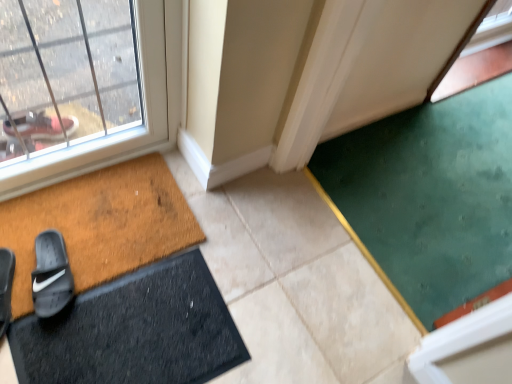
Question: Is brown textured doormat at lower left, which appears as the 1th bath mat when viewed from the top, not within black rubber bath mat at lower left, positioned as the first bath mat in bottom-to-top order?

Choices:
 (A) no
 (B) yes

Answer: (B)

Question: Is brown textured doormat at lower left, which appears as the 1th bath mat when viewed from the top, wider than black rubber bath mat at lower left, positioned as the first bath mat in bottom-to-top order?

Choices:
 (A) yes
 (B) no

Answer: (A)

Question: Could you tell me if brown textured doormat at lower left, which appears as the 1th bath mat when viewed from the top, is turned towards black rubber bath mat at lower left, which is the second bath mat in top-to-bottom order?

Choices:
 (A) no
 (B) yes

Answer: (B)

Question: Is brown textured doormat at lower left, which appears as the 1th bath mat when viewed from the top, thinner than black rubber bath mat at lower left, which is the second bath mat in top-to-bottom order?

Choices:
 (A) yes
 (B) no

Answer: (B)

Question: Does brown textured doormat at lower left, which appears as the 1th bath mat when viewed from the top, lie in front of black rubber bath mat at lower left, positioned as the first bath mat in bottom-to-top order?

Choices:
 (A) yes
 (B) no

Answer: (B)

Question: Is brown textured doormat at lower left, which appears as the 1th bath mat when viewed from the top, in contact with black rubber bath mat at lower left, positioned as the first bath mat in bottom-to-top order?

Choices:
 (A) yes
 (B) no

Answer: (B)

Question: Does black rubber bath mat at lower left, positioned as the first bath mat in bottom-to-top order, have a lesser height compared to black suede slide at lower left, the 1th footwear viewed from the left?

Choices:
 (A) no
 (B) yes

Answer: (B)

Question: Does black rubber bath mat at lower left, which is the second bath mat in top-to-bottom order, have a greater height compared to black suede slide at lower left, the 1th footwear viewed from the left?

Choices:
 (A) no
 (B) yes

Answer: (A)

Question: Is black rubber bath mat at lower left, positioned as the first bath mat in bottom-to-top order, positioned behind black suede slide at lower left, the 1th footwear viewed from the left?

Choices:
 (A) yes
 (B) no

Answer: (B)

Question: Considering the relative sizes of black rubber bath mat at lower left, positioned as the first bath mat in bottom-to-top order, and black suede slide at lower left, acting as the second footwear starting from the right, in the image provided, is black rubber bath mat at lower left, positioned as the first bath mat in bottom-to-top order, wider than black suede slide at lower left, acting as the second footwear starting from the right,?

Choices:
 (A) yes
 (B) no

Answer: (A)

Question: Can you confirm if black rubber bath mat at lower left, which is the second bath mat in top-to-bottom order, is positioned to the right of black suede slide at lower left, acting as the second footwear starting from the right?

Choices:
 (A) yes
 (B) no

Answer: (A)

Question: Does black rubber bath mat at lower left, which is the second bath mat in top-to-bottom order, have a larger size compared to black suede slide at lower left, the 1th footwear viewed from the left?

Choices:
 (A) no
 (B) yes

Answer: (B)

Question: From the image's perspective, is black rubber slide at lower left, positioned as the first footwear in right-to-left order, below black suede slide at lower left, the 1th footwear viewed from the left?

Choices:
 (A) no
 (B) yes

Answer: (A)